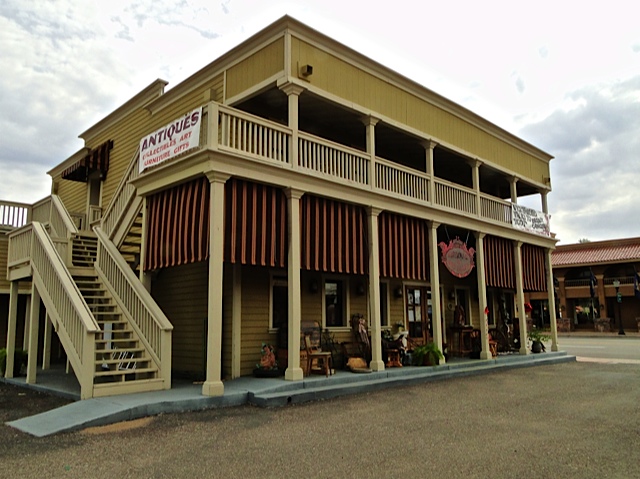
Image resolution: width=640 pixels, height=479 pixels. Identify the location of stairs. (105, 334), (124, 232).